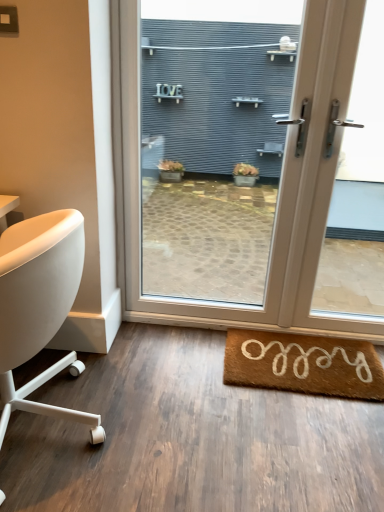
Question: Considering their positions, is white plastic door at center located in front of or behind white glossy door at center?

Choices:
 (A) behind
 (B) front

Answer: (B)

Question: Based on their sizes in the image, would you say white plastic door at center is bigger or smaller than white glossy door at center?

Choices:
 (A) big
 (B) small

Answer: (B)

Question: Estimate the real-world distances between objects in this image. Which object is farther from the brown coir mat at lower right?

Choices:
 (A) white leather chair at left
 (B) white plastic door at center
 (C) white glossy door at center

Answer: (A)

Question: Estimate the real-world distances between objects in this image. Which object is closer to the brown coir mat at lower right?

Choices:
 (A) white leather chair at left
 (B) white plastic door at center
 (C) white glossy door at center

Answer: (B)